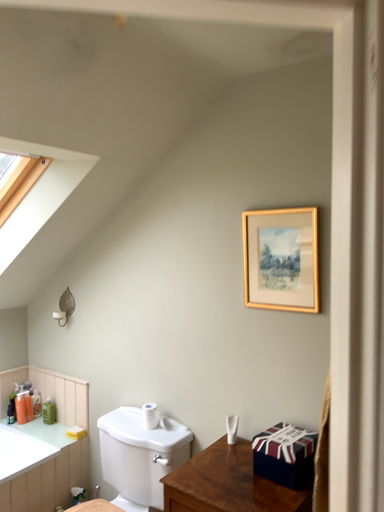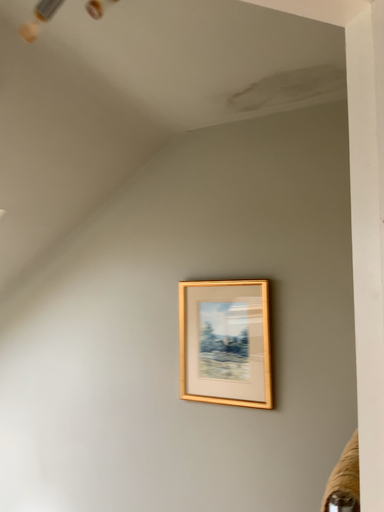
Question: How did the camera likely rotate when shooting the video?

Choices:
 (A) rotated upward
 (B) rotated downward

Answer: (A)